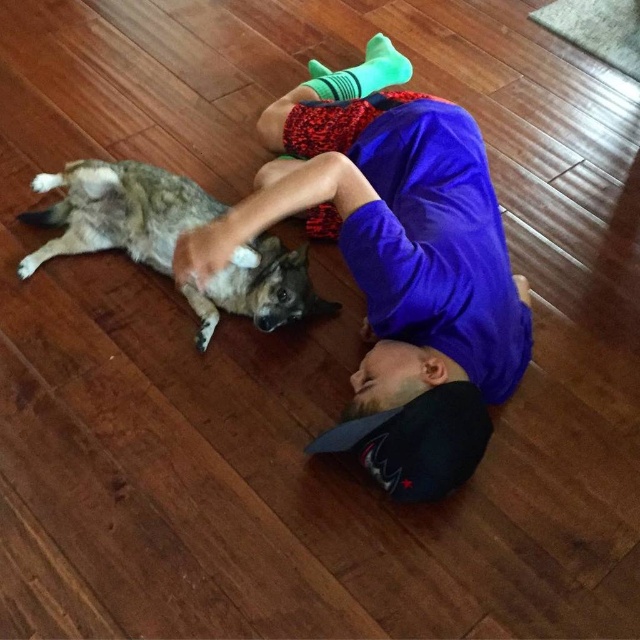
Question: Among these objects, which one is farthest from the camera?

Choices:
 (A) brown fur dog at upper left
 (B) purple cotton shirt at center

Answer: (A)

Question: Can you confirm if purple cotton shirt at center is positioned above brown fur dog at upper left?

Choices:
 (A) no
 (B) yes

Answer: (B)

Question: Considering the relative positions of purple cotton shirt at center and brown fur dog at upper left in the image provided, where is purple cotton shirt at center located with respect to brown fur dog at upper left?

Choices:
 (A) right
 (B) left

Answer: (A)

Question: Can you confirm if purple cotton shirt at center is smaller than brown fur dog at upper left?

Choices:
 (A) no
 (B) yes

Answer: (A)

Question: Among these points, which one is farthest from the camera?

Choices:
 (A) (218, 301)
 (B) (454, 291)

Answer: (A)

Question: Which point is farther to the camera?

Choices:
 (A) (435, 118)
 (B) (260, 260)

Answer: (B)